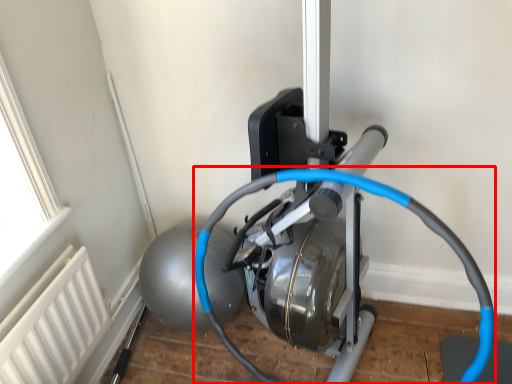
Question: From the image's perspective, considering the relative positions of wire (annotated by the red box) and radiator in the image provided, where is wire (annotated by the red box) located with respect to the staircase?

Choices:
 (A) above
 (B) below

Answer: (A)